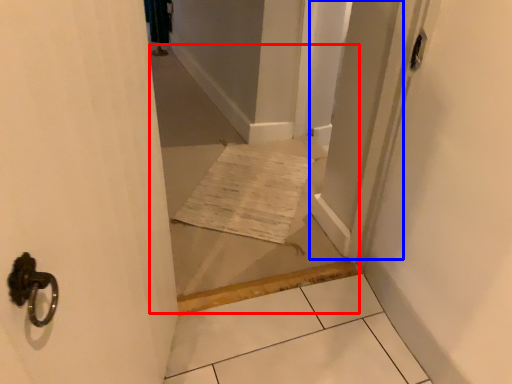
Question: Which object is further to the camera taking this photo, corridor (highlighted by a red box) or screen door (highlighted by a blue box)?

Choices:
 (A) corridor
 (B) screen door

Answer: (B)